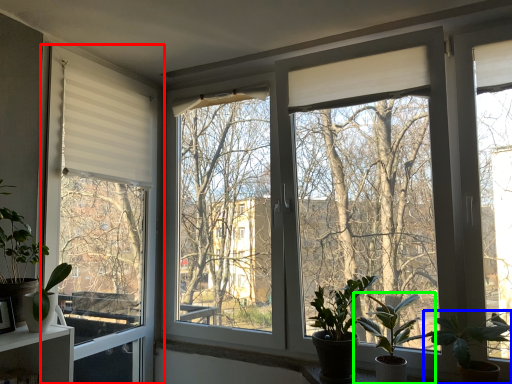
Question: Based on their relative distances, which object is farther from window (highlighted by a red box)? Choose from houseplant (highlighted by a blue box) and houseplant (highlighted by a green box).

Choices:
 (A) houseplant
 (B) houseplant

Answer: (A)